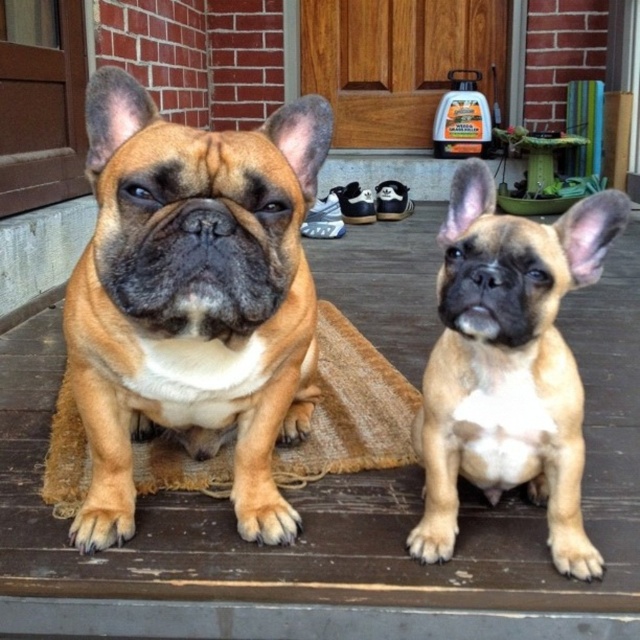
Question: In this image, where is brown matte dog at center located relative to burlap mat at center?

Choices:
 (A) right
 (B) left

Answer: (B)

Question: Does brown matte dog at center appear on the right side of burlap mat at center?

Choices:
 (A) no
 (B) yes

Answer: (A)

Question: Which of the following is the closest to the observer?

Choices:
 (A) (477, 284)
 (B) (140, 179)
 (C) (289, 468)

Answer: (B)

Question: Which object is positioned closest to the burlap mat at center?

Choices:
 (A) golden fur puppy at center
 (B) brown matte dog at center

Answer: (B)

Question: Observing the image, what is the correct spatial positioning of golden fur puppy at center in reference to burlap mat at center?

Choices:
 (A) above
 (B) below

Answer: (A)

Question: Which point is farther to the camera?

Choices:
 (A) brown matte dog at center
 (B) burlap mat at center

Answer: (B)